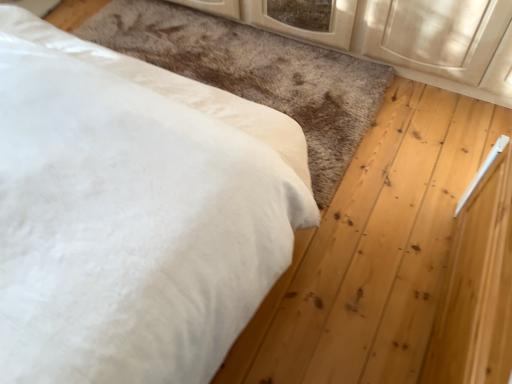
Question: Is white soft rug at lower left positioned far away from white soft bed at upper left?

Choices:
 (A) no
 (B) yes

Answer: (A)

Question: Is white soft rug at lower left oriented away from white soft bed at upper left?

Choices:
 (A) yes
 (B) no

Answer: (B)

Question: Does white soft rug at lower left appear on the left side of white soft bed at upper left?

Choices:
 (A) no
 (B) yes

Answer: (A)

Question: Is white soft rug at lower left facing towards white soft bed at upper left?

Choices:
 (A) no
 (B) yes

Answer: (A)

Question: Can you confirm if white soft rug at lower left is wider than white soft bed at upper left?

Choices:
 (A) yes
 (B) no

Answer: (A)

Question: Does white soft rug at lower left have a lesser height compared to white soft bed at upper left?

Choices:
 (A) yes
 (B) no

Answer: (A)

Question: Could you tell me if white soft bed at upper left is turned towards white soft rug at lower left?

Choices:
 (A) yes
 (B) no

Answer: (A)

Question: From a real-world perspective, is white soft bed at upper left on white soft rug at lower left?

Choices:
 (A) no
 (B) yes

Answer: (B)

Question: Is white soft bed at upper left wider than white soft rug at lower left?

Choices:
 (A) no
 (B) yes

Answer: (A)

Question: From the image's perspective, is white soft bed at upper left located above white soft rug at lower left?

Choices:
 (A) yes
 (B) no

Answer: (B)

Question: Is white soft bed at upper left not within white soft rug at lower left?

Choices:
 (A) no
 (B) yes

Answer: (B)

Question: Does white soft bed at upper left contain white soft rug at lower left?

Choices:
 (A) no
 (B) yes

Answer: (A)

Question: In terms of size, does white soft rug at lower left appear bigger or smaller than white soft bed at upper left?

Choices:
 (A) small
 (B) big

Answer: (A)